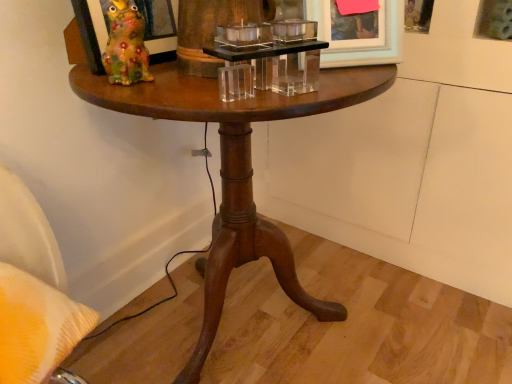
This screenshot has width=512, height=384. Find the location of `vacant area situated to the left side of clear acrylic candle holder at center`. vacant area situated to the left side of clear acrylic candle holder at center is located at coordinates (154, 91).